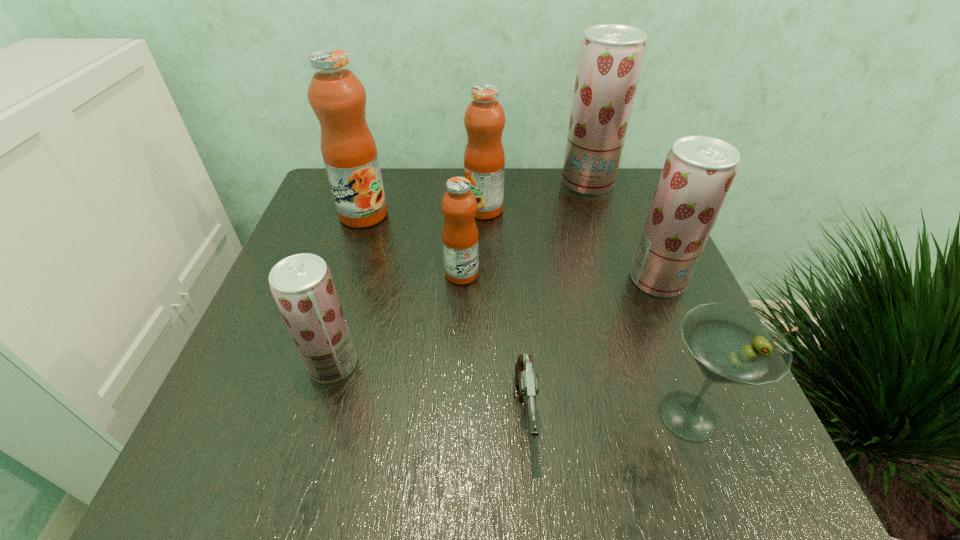
At what (x,y) coordinates should I click in order to perform the action: click on the farthest strawberry fruit juice. Please return your answer as a coordinate pair (x, y). Looking at the image, I should click on (611, 56).

Locate an element on the screen. This screenshot has height=540, width=960. the biggest strawberry fruit juice is located at coordinates (611, 56).

Find the location of `the leftmost orange fruit juice`. the leftmost orange fruit juice is located at coordinates (336, 95).

This screenshot has width=960, height=540. In order to click on the second biggest strawberry fruit juice in this screenshot , I will do coord(698,172).

Locate an element on the screen. the second smallest orange fruit juice is located at coordinates (484, 158).

At what (x,y) coordinates should I click in order to perform the action: click on the nearest fruit juice. Please return your answer as a coordinate pair (x, y). Looking at the image, I should click on (302, 285).

I want to click on the nearest strawberry fruit juice, so click(302, 285).

Where is `the nearest orange fruit juice`? the nearest orange fruit juice is located at coordinates (459, 205).

The height and width of the screenshot is (540, 960). Find the location of `martini`. martini is located at coordinates (730, 344).

Where is `the fifth object from left to right`? the fifth object from left to right is located at coordinates (527, 379).